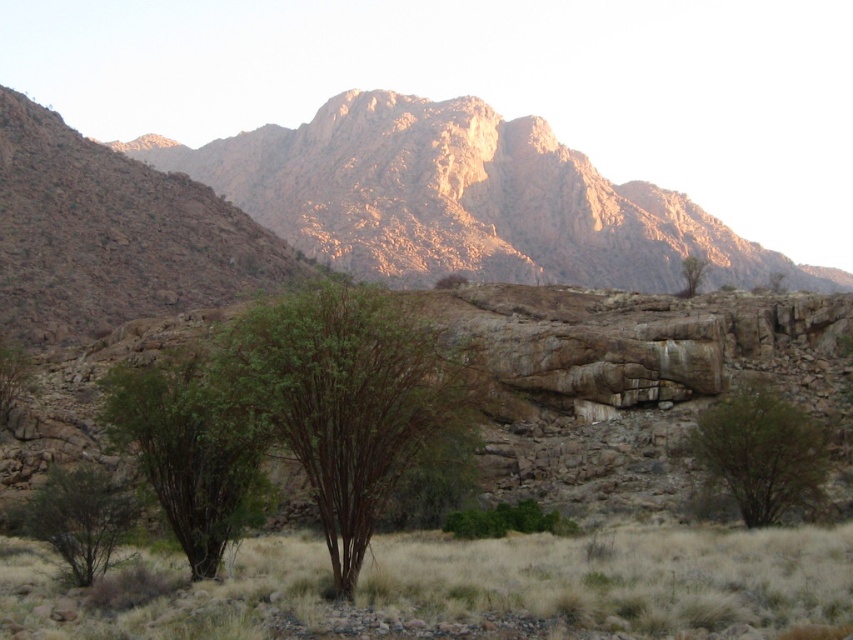
Does green leafy shrub at center have a lesser height compared to green matte tree at lower left?

No.

Between point (712, 502) and point (22, 362), which one is positioned in front?

Point (712, 502) is more forward.

Does point (753, 444) lie behind point (7, 371)?

No, (753, 444) is closer to viewer.

Locate an element on the screen. green leafy shrub at center is located at coordinates (758, 454).

Measure the distance between green leafy bush at center and green leafy tree at upper right.

green leafy bush at center and green leafy tree at upper right are 150.56 feet apart.

Which of these two, green leafy bush at center or green leafy tree at upper right, stands taller?

With more height is green leafy tree at upper right.

Is point (511, 516) positioned after point (701, 269)?

That is False.

The width and height of the screenshot is (853, 640). What are the coordinates of `green leafy bush at center` in the screenshot? It's located at (506, 520).

Does rugged rock mountain at upper center have a greater height compared to green leafy tree at center?

Correct, rugged rock mountain at upper center is much taller as green leafy tree at center.

Between point (328, 100) and point (144, 422), which one is positioned in front?

Point (144, 422) is more forward.

Locate an element on the screen. This screenshot has width=853, height=640. rugged rock mountain at upper center is located at coordinates (463, 198).